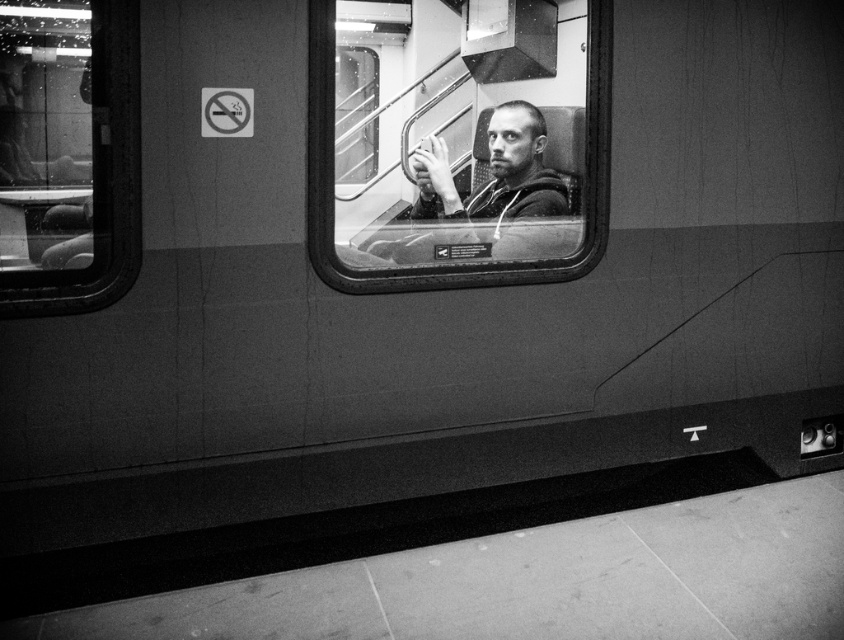
Question: Is clear glass train window at left to the left of smooth gray hoodie at center from the viewer's perspective?

Choices:
 (A) yes
 (B) no

Answer: (A)

Question: Considering the relative positions of metallic glass train window at center and clear glass train window at left in the image provided, where is metallic glass train window at center located with respect to clear glass train window at left?

Choices:
 (A) right
 (B) left

Answer: (A)

Question: Based on their relative distances, which object is farther from the metallic glass train window at center?

Choices:
 (A) clear glass train window at left
 (B) smooth gray hoodie at center

Answer: (A)

Question: Which object appears closest to the camera in this image?

Choices:
 (A) clear glass train window at left
 (B) metallic glass train window at center
 (C) smooth gray hoodie at center

Answer: (A)

Question: Which of the following is the closest to the observer?

Choices:
 (A) (529, 182)
 (B) (74, 17)
 (C) (475, 234)

Answer: (B)

Question: Considering the relative positions of metallic glass train window at center and smooth gray hoodie at center in the image provided, where is metallic glass train window at center located with respect to smooth gray hoodie at center?

Choices:
 (A) above
 (B) below

Answer: (A)